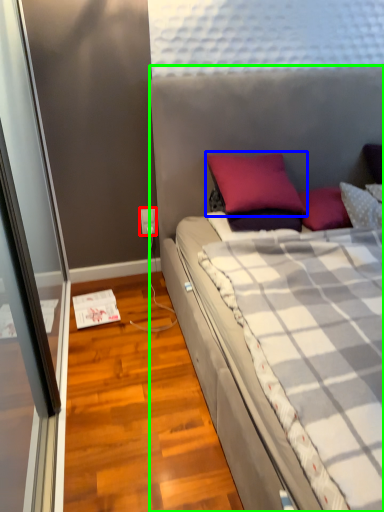
Question: Which object is positioned farthest from power outlet (highlighted by a red box)? Select from pillow (highlighted by a blue box) and bed (highlighted by a green box).

Choices:
 (A) pillow
 (B) bed

Answer: (B)